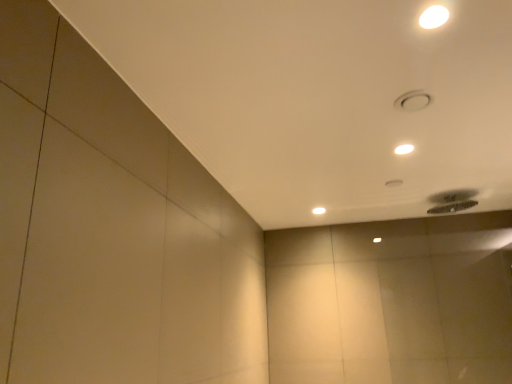
Question: Are white glossy lamp at upper right, which appears as the 2th lamp when ordered from the bottom, and white glossy lamp at upper right, which appears as the 3th lamp when ordered from the bottom, located far from each other?

Choices:
 (A) no
 (B) yes

Answer: (A)

Question: Is white glossy lamp at upper right, which appears as the 2th lamp when ordered from the bottom, beside white glossy lamp at upper right, marked as the third lamp in a back-to-front arrangement?

Choices:
 (A) no
 (B) yes

Answer: (A)

Question: Does white glossy lamp at upper right, the first lamp in the right-to-left sequence, appear on the right side of white glossy lamp at upper right, placed as the first lamp when sorted from top to bottom?

Choices:
 (A) yes
 (B) no

Answer: (A)

Question: Does white glossy lamp at upper right, which appears as the 2th lamp when viewed from the front, have a lesser height compared to white glossy lamp at upper right, which appears as the 2th lamp when viewed from the left?

Choices:
 (A) no
 (B) yes

Answer: (B)

Question: From the image's perspective, is white glossy lamp at upper right, which is the 2th lamp in back-to-front order, beneath white glossy lamp at upper right, placed as the first lamp when sorted from top to bottom?

Choices:
 (A) yes
 (B) no

Answer: (A)

Question: From the image's perspective, relative to white glossy lamp at upper center, the third lamp positioned from the right, is white glossy lamp at upper right, the 3th lamp positioned from the left, above or below?

Choices:
 (A) below
 (B) above

Answer: (B)

Question: In terms of width, does white glossy lamp at upper right, which appears as the 2th lamp when viewed from the front, look wider or thinner when compared to white glossy lamp at upper center, the third lamp positioned from the right?

Choices:
 (A) wide
 (B) thin

Answer: (B)

Question: Based on their sizes in the image, would you say white glossy lamp at upper right, which is the 2th lamp in back-to-front order, is bigger or smaller than white glossy lamp at upper center, the 1th lamp from the bottom?

Choices:
 (A) big
 (B) small

Answer: (B)

Question: From a real-world perspective, is white glossy lamp at upper right, the first lamp in the right-to-left sequence, above or below white glossy lamp at upper center, the third lamp in the front-to-back sequence?

Choices:
 (A) below
 (B) above

Answer: (B)

Question: From the image's perspective, is white glossy lamp at upper center, which appears as the third lamp when viewed from the top, located above or below white glossy lamp at upper right, which appears as the 2th lamp when viewed from the left?

Choices:
 (A) below
 (B) above

Answer: (A)

Question: Considering the positions of white glossy lamp at upper center, the 1th lamp positioned from the left, and white glossy lamp at upper right, which is the second lamp in right-to-left order, in the image, is white glossy lamp at upper center, the 1th lamp positioned from the left, taller or shorter than white glossy lamp at upper right, which is the second lamp in right-to-left order,?

Choices:
 (A) short
 (B) tall

Answer: (B)

Question: Considering the positions of white glossy lamp at upper center, the 1th lamp from the bottom, and white glossy lamp at upper right, the 1th lamp positioned from the front, in the image, is white glossy lamp at upper center, the 1th lamp from the bottom, wider or thinner than white glossy lamp at upper right, the 1th lamp positioned from the front,?

Choices:
 (A) thin
 (B) wide

Answer: (B)

Question: From a real-world perspective, is white glossy lamp at upper center, the third lamp in the front-to-back sequence, physically located above or below white glossy lamp at upper right, which appears as the 2th lamp when viewed from the left?

Choices:
 (A) below
 (B) above

Answer: (A)

Question: From a real-world perspective, is white glossy lamp at upper center, the third lamp positioned from the right, positioned above or below white glossy lamp at upper right, the first lamp in the right-to-left sequence?

Choices:
 (A) below
 (B) above

Answer: (A)

Question: Does point (311, 210) appear closer or farther from the camera than point (394, 150)?

Choices:
 (A) farther
 (B) closer

Answer: (A)